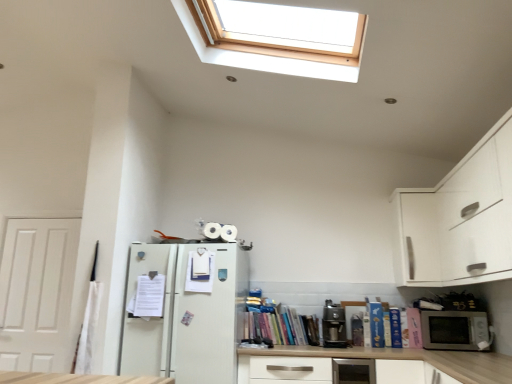
Question: Are satin silver toaster at lower center and white paper at left, the 1th book positioned from the left, making contact?

Choices:
 (A) yes
 (B) no

Answer: (B)

Question: Can you confirm if satin silver toaster at lower center is thinner than white paper at left, the 1th book positioned from the left?

Choices:
 (A) yes
 (B) no

Answer: (B)

Question: Considering the relative positions of satin silver toaster at lower center and white paper at left, the 1th book positioned from the left, in the image provided, is satin silver toaster at lower center to the right of white paper at left, the 1th book positioned from the left, from the viewer's perspective?

Choices:
 (A) yes
 (B) no

Answer: (A)

Question: From the image's perspective, is satin silver toaster at lower center below white paper at left, the 1th book positioned from the left?

Choices:
 (A) no
 (B) yes

Answer: (B)

Question: Is satin silver toaster at lower center at the left side of white paper at left, the 7th book when ordered from right to left?

Choices:
 (A) yes
 (B) no

Answer: (B)

Question: From the image's perspective, is white matte book at center, the second book viewed from the left, located above or below white matte door at left?

Choices:
 (A) above
 (B) below

Answer: (A)

Question: Looking at the image, does white matte book at center, the 6th book viewed from the right, seem bigger or smaller compared to white matte door at left?

Choices:
 (A) small
 (B) big

Answer: (A)

Question: Does point (209, 274) appear closer or farther from the camera than point (71, 248)?

Choices:
 (A) farther
 (B) closer

Answer: (B)

Question: Is white matte book at center, the second book viewed from the left, in front of or behind white matte door at left in the image?

Choices:
 (A) behind
 (B) front

Answer: (B)

Question: Would you say white paper at left, the 1th book positioned from the left, is inside or outside hardcover book at right, arranged as the 7th book when viewed from the left?

Choices:
 (A) inside
 (B) outside

Answer: (B)

Question: Is point (137, 307) positioned closer to the camera than point (413, 329)?

Choices:
 (A) closer
 (B) farther

Answer: (A)

Question: From a real-world perspective, relative to hardcover book at right, positioned as the 1th book in right-to-left order, is white paper at left, the 7th book when ordered from right to left, vertically above or below?

Choices:
 (A) below
 (B) above

Answer: (B)

Question: Considering the positions of white paper at left, the 7th book when ordered from right to left, and hardcover book at right, positioned as the 1th book in right-to-left order, in the image, is white paper at left, the 7th book when ordered from right to left, wider or thinner than hardcover book at right, positioned as the 1th book in right-to-left order,?

Choices:
 (A) thin
 (B) wide

Answer: (A)

Question: From a real-world perspective, is satin silver toaster at lower center positioned above or below hardcover book at right, arranged as the 7th book when viewed from the left?

Choices:
 (A) below
 (B) above

Answer: (A)

Question: In the image, is satin silver toaster at lower center on the left side or the right side of hardcover book at right, positioned as the 1th book in right-to-left order?

Choices:
 (A) right
 (B) left

Answer: (B)